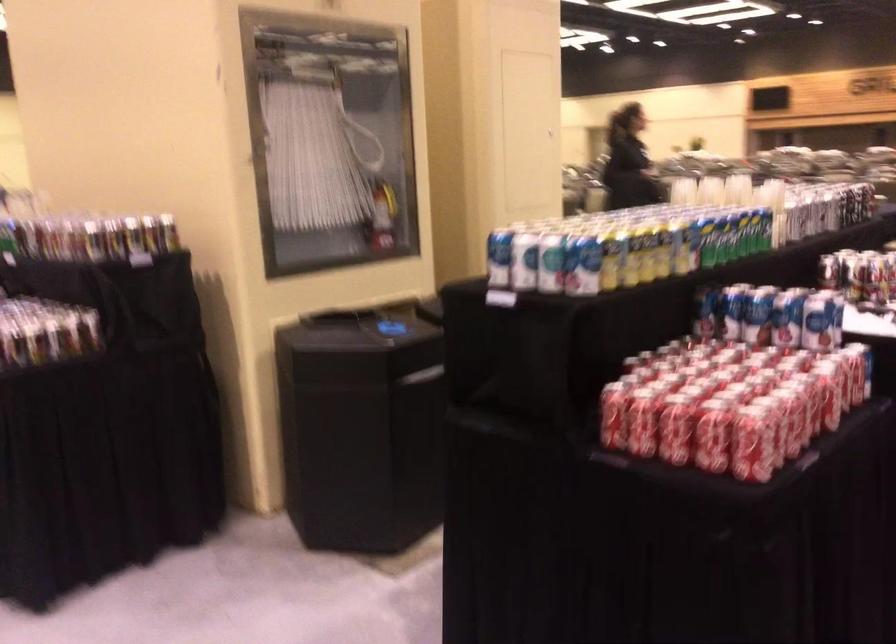
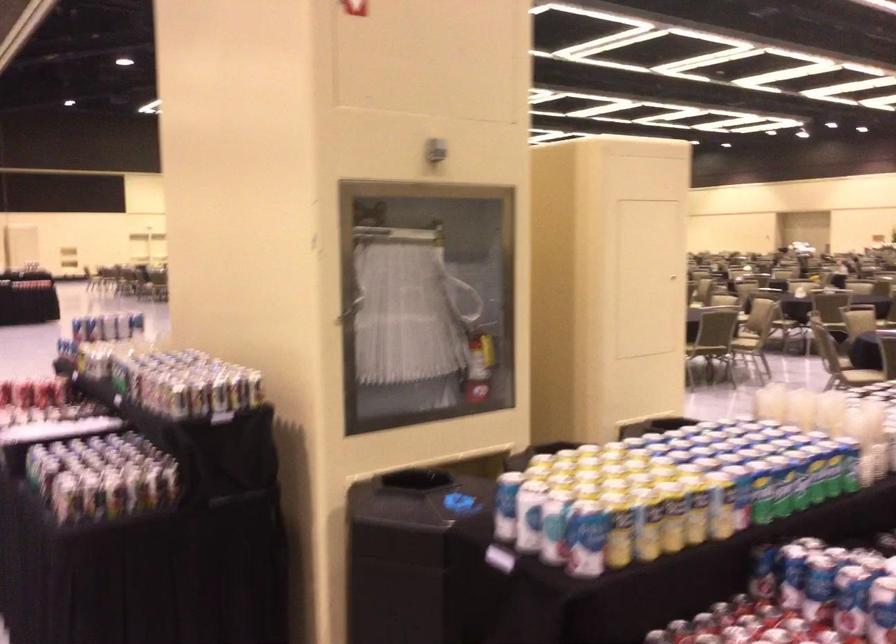
Question: I am providing you with two images of the same scene from different viewpoints. Which of the following objects are not visible in image2?

Choices:
 (A) red fire extinguisher
 (B) chair sitting surface
 (C) small beverage bottle
 (D) none of these

Answer: (D)